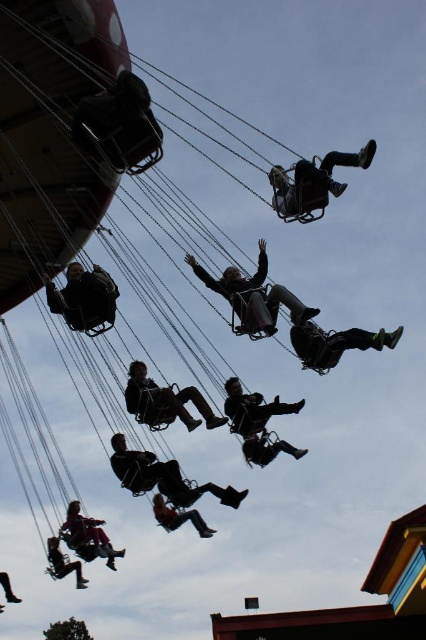
You are standing at the center of the fairground and want to locate the dark gray fabric swing at lower right. According to the image coordinates, where exactly is it positioned?

The dark gray fabric swing at lower right is positioned at coordinates point (334, 342).

You are standing at the entrance of the amusement park and see the swing ride with the matte black helmet at upper center and the matte black person at lower left. Which object is positioned to the right side of the other?

The matte black helmet at upper center is to the right of the matte black person at lower left.

You are a visitor at the fairground and notice the dark gray fabric swing at center and the matte black pants at center. Which object is positioned higher in the image?

The dark gray fabric swing at center is located above the matte black pants at center, so it is positioned higher in the image.